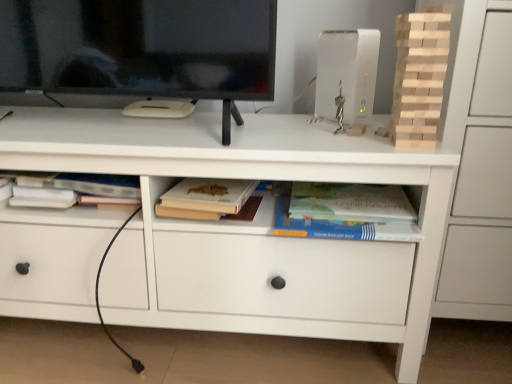
Find the location of a particular element. free region on the left part of natural wood tower at upper right is located at coordinates (347, 147).